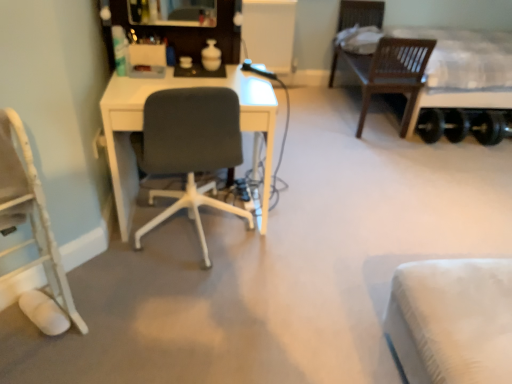
Question: Considering the relative positions of matte gray chair at center, acting as the second chair starting from the left, and wooden bed at right in the image provided, is matte gray chair at center, acting as the second chair starting from the left, to the left or to the right of wooden bed at right?

Choices:
 (A) left
 (B) right

Answer: (A)

Question: From a real-world perspective, relative to wooden bed at right, is matte gray chair at center, acting as the second chair starting from the left, vertically above or below?

Choices:
 (A) above
 (B) below

Answer: (B)

Question: Estimate the real-world distances between objects in this image. Which object is farther from the wooden bed at right?

Choices:
 (A) white fabric chair at lower left, positioned as the 1th chair in left-to-right order
 (B) matte gray chair at center, which is the 1th chair from right to left

Answer: (A)

Question: Which object is positioned farthest from the wooden bed at right?

Choices:
 (A) white fabric chair at lower left, the 2th chair when ordered from right to left
 (B) matte gray chair at center, acting as the second chair starting from the left

Answer: (A)